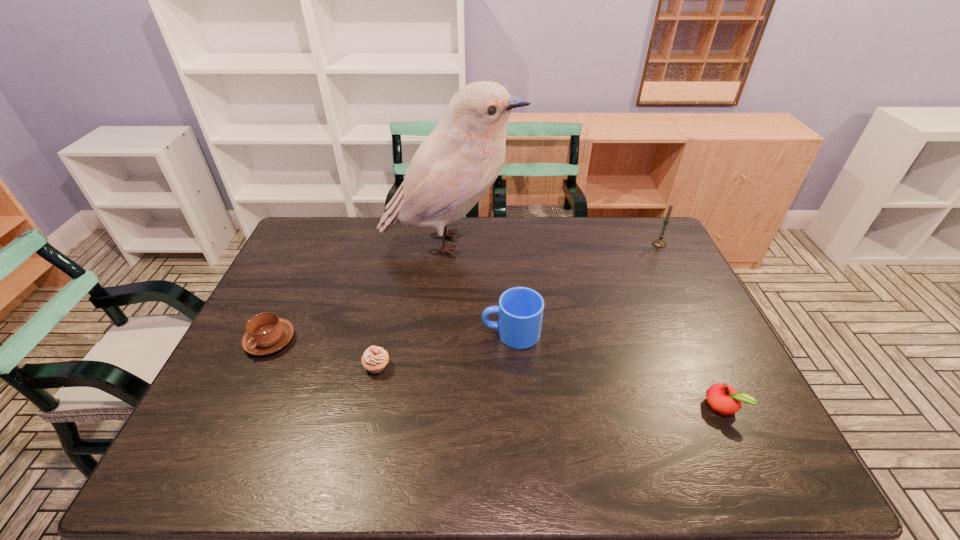
Where is `empty space that is in between the mug and the nearest object`? The height and width of the screenshot is (540, 960). empty space that is in between the mug and the nearest object is located at coordinates (616, 369).

In order to click on free space between the cappuccino and the mug in this screenshot , I will do `click(391, 337)`.

The width and height of the screenshot is (960, 540). Find the location of `vacant area between the mug and the tallest object`. vacant area between the mug and the tallest object is located at coordinates (481, 288).

Where is `vacant space that is in between the mug and the parakeet`? This screenshot has height=540, width=960. vacant space that is in between the mug and the parakeet is located at coordinates (481, 288).

Image resolution: width=960 pixels, height=540 pixels. Find the location of `vacant area that lies between the cappuccino and the third tallest object`. vacant area that lies between the cappuccino and the third tallest object is located at coordinates [x=391, y=337].

Image resolution: width=960 pixels, height=540 pixels. I want to click on object that is the third closest to the leftmost object, so click(520, 311).

I want to click on object that is the second closest to the tallest object, so click(x=266, y=333).

Identify the location of free space that satisfies the following two spatial constraints: 1. on the side of the nearest object with the handle; 2. on the right side of the third tallest object. (516, 406).

Identify the location of vacant space that satisfies the following two spatial constraints: 1. on the back side of the apple; 2. on the side of the fourth shortest object with the handle. This screenshot has width=960, height=540. (688, 333).

Image resolution: width=960 pixels, height=540 pixels. In order to click on vacant space that satisfies the following two spatial constraints: 1. on the side of the leftmost object with the handle; 2. on the right side of the third shortest object in this screenshot , I will do `click(258, 366)`.